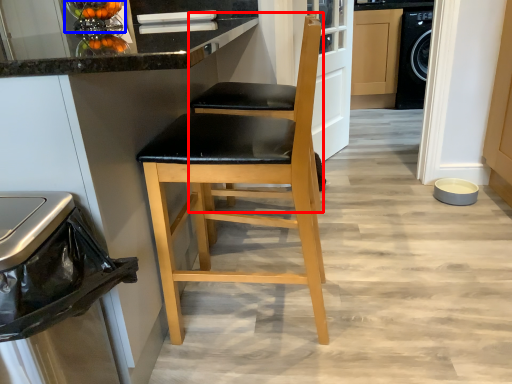
Question: Which object appears farthest to the camera in this image, chair (highlighted by a red box) or appliance (highlighted by a blue box)?

Choices:
 (A) chair
 (B) appliance

Answer: (B)